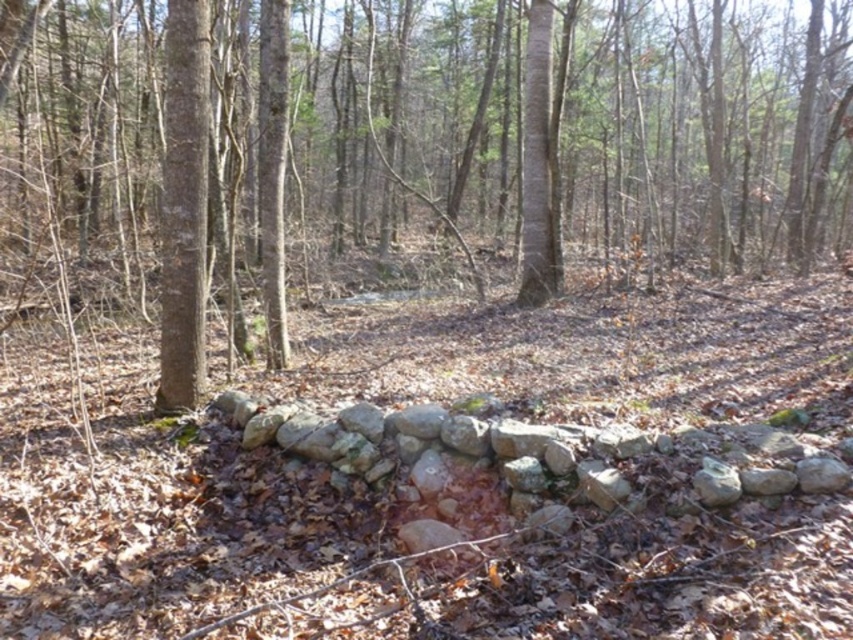
Is brown rough tree at center shorter than smooth brown tree trunk at left?

In fact, brown rough tree at center may be taller than smooth brown tree trunk at left.

Between brown rough tree at center and smooth brown tree trunk at left, which one has more height?

With more height is brown rough tree at center.

This screenshot has height=640, width=853. What are the coordinates of `brown rough tree at center` in the screenshot? It's located at (405, 152).

Who is higher up, brown rough tree at center or smooth bark tree at center?

Positioned higher is brown rough tree at center.

Which is more to the right, brown rough tree at center or smooth bark tree at center?

smooth bark tree at center is more to the right.

The image size is (853, 640). What do you see at coordinates (405, 152) in the screenshot?
I see `brown rough tree at center` at bounding box center [405, 152].

You are a GUI agent. You are given a task and a screenshot of the screen. Output one action in this format:
    pyautogui.click(x=<x>, y=<y>)
    Task: Click on the brown rough tree at center
    
    Given the screenshot: What is the action you would take?
    pyautogui.click(x=405, y=152)

Is point (184, 214) behind point (537, 212)?

No, (184, 214) is in front of (537, 212).

Between smooth brown tree trunk at left and smooth bark tree at center, which one has less height?

smooth brown tree trunk at left

You are a GUI agent. You are given a task and a screenshot of the screen. Output one action in this format:
    pyautogui.click(x=<x>, y=<y>)
    Task: Click on the smooth brown tree trunk at left
    
    Given the screenshot: What is the action you would take?
    click(183, 205)

You are a GUI agent. You are given a task and a screenshot of the screen. Output one action in this format:
    pyautogui.click(x=<x>, y=<y>)
    Task: Click on the smooth brown tree trunk at left
    The image size is (853, 640).
    Given the screenshot: What is the action you would take?
    pyautogui.click(x=183, y=205)